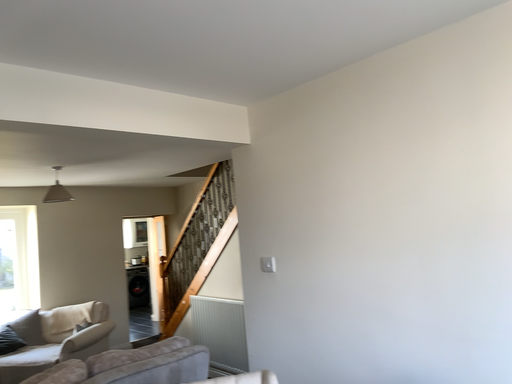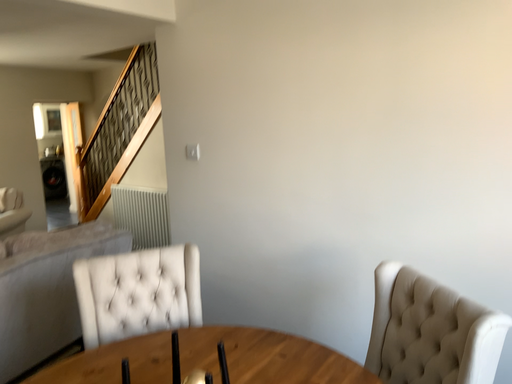
Question: Which way did the camera rotate in the video?

Choices:
 (A) rotated left
 (B) rotated right

Answer: (B)